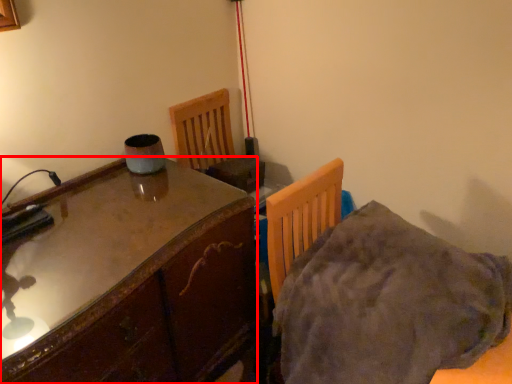
Question: From the image's perspective, considering the relative positions of table (annotated by the red box) and blanket in the image provided, where is table (annotated by the red box) located with respect to the staircase?

Choices:
 (A) below
 (B) above

Answer: (A)